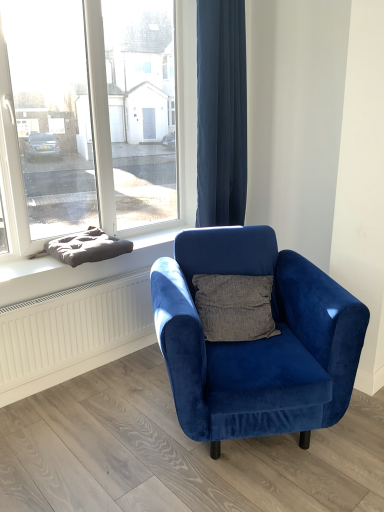
Question: From a real-world perspective, is velvet blue armchair at center under transparent glass window at upper left?

Choices:
 (A) no
 (B) yes

Answer: (B)

Question: Can transparent glass window at upper left be found inside velvet blue armchair at center?

Choices:
 (A) yes
 (B) no

Answer: (B)

Question: From a real-world perspective, is velvet blue armchair at center positioned over transparent glass window at upper left based on gravity?

Choices:
 (A) no
 (B) yes

Answer: (A)

Question: Considering the relative sizes of velvet blue armchair at center and transparent glass window at upper left in the image provided, is velvet blue armchair at center thinner than transparent glass window at upper left?

Choices:
 (A) yes
 (B) no

Answer: (B)

Question: Does velvet blue armchair at center have a smaller size compared to transparent glass window at upper left?

Choices:
 (A) no
 (B) yes

Answer: (A)

Question: Is white textured radiator at lower left wider or thinner than transparent glass window at upper left?

Choices:
 (A) thin
 (B) wide

Answer: (A)

Question: From their relative heights in the image, would you say white textured radiator at lower left is taller or shorter than transparent glass window at upper left?

Choices:
 (A) short
 (B) tall

Answer: (A)

Question: From a real-world perspective, is white textured radiator at lower left positioned above or below transparent glass window at upper left?

Choices:
 (A) above
 (B) below

Answer: (B)

Question: Based on their sizes in the image, would you say white textured radiator at lower left is bigger or smaller than transparent glass window at upper left?

Choices:
 (A) small
 (B) big

Answer: (A)

Question: Is dark gray cushion at left wider or thinner than transparent glass window at upper left?

Choices:
 (A) thin
 (B) wide

Answer: (B)

Question: From a real-world perspective, is dark gray cushion at left physically located above or below transparent glass window at upper left?

Choices:
 (A) above
 (B) below

Answer: (B)

Question: Considering the positions of dark gray cushion at left and transparent glass window at upper left in the image, is dark gray cushion at left bigger or smaller than transparent glass window at upper left?

Choices:
 (A) small
 (B) big

Answer: (A)

Question: Is point (145, 242) positioned closer to the camera than point (187, 183)?

Choices:
 (A) farther
 (B) closer

Answer: (B)

Question: Considering the positions of point (28, 261) and point (215, 249), is point (28, 261) closer or farther from the camera than point (215, 249)?

Choices:
 (A) farther
 (B) closer

Answer: (A)

Question: Which is correct: dark gray cushion at left is inside velvet blue armchair at center, or outside of it?

Choices:
 (A) outside
 (B) inside

Answer: (A)